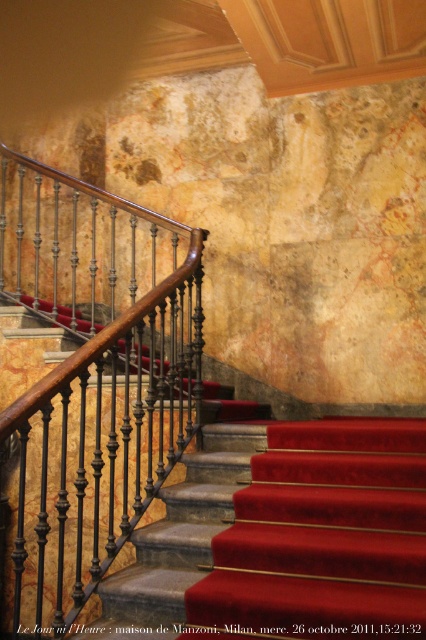
Which of these two, wooden polished handrail at center or velvet red carpet at center, stands shorter?

velvet red carpet at center is shorter.

Is wooden polished handrail at center positioned in front of velvet red carpet at center?

No.

This screenshot has height=640, width=426. What are the coordinates of `wooden polished handrail at center` in the screenshot? It's located at (92, 380).

Locate an element on the screen. The height and width of the screenshot is (640, 426). wooden polished handrail at center is located at coordinates (92, 380).